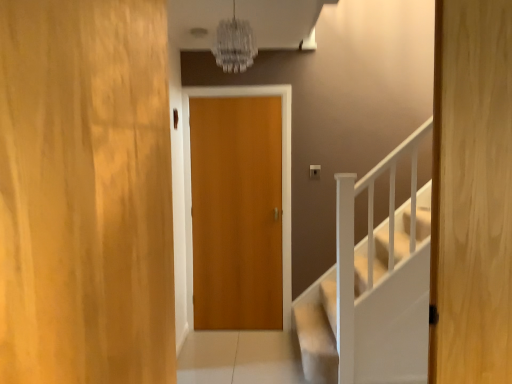
Question: Which direction should I rotate to look at wooden door at center, the second door in the front-to-back sequence?

Choices:
 (A) left
 (B) right

Answer: (B)

Question: Is wooden door at center, which is the first door in back-to-front order, to the right of wooden door at center, positioned as the 1th door in front-to-back order, from the viewer's perspective?

Choices:
 (A) no
 (B) yes

Answer: (B)

Question: From the image's perspective, would you say wooden door at center, the third door from the front, is shown under wooden door at center, positioned as the 1th door in front-to-back order?

Choices:
 (A) yes
 (B) no

Answer: (A)

Question: Is wooden door at center, the third door from the front, bigger than wooden door at center, which is the third door in right-to-left order?

Choices:
 (A) no
 (B) yes

Answer: (A)

Question: Is the depth of wooden door at center, which is the first door in back-to-front order, greater than that of wooden door at center, marked as the 3th door in a back-to-front arrangement?

Choices:
 (A) no
 (B) yes

Answer: (B)

Question: Is wooden door at center, the third door from the front, facing away from wooden door at center, marked as the 3th door in a back-to-front arrangement?

Choices:
 (A) yes
 (B) no

Answer: (B)

Question: Can you confirm if wooden door at center, the second door in the right-to-left sequence, is smaller than wooden door at center, which is the third door in right-to-left order?

Choices:
 (A) yes
 (B) no

Answer: (A)

Question: Would you consider wooden door at center, which is the 1th door from right to left, to be distant from wooden door at center, marked as the 2th door in a left-to-right arrangement?

Choices:
 (A) yes
 (B) no

Answer: (A)

Question: From the image's perspective, is wooden door at center, which is the 1th door from right to left, located beneath wooden door at center, marked as the 2th door in a left-to-right arrangement?

Choices:
 (A) no
 (B) yes

Answer: (A)

Question: Is wooden door at center, the second door in the front-to-back sequence, directly adjacent to wooden door at center, the second door in the right-to-left sequence?

Choices:
 (A) yes
 (B) no

Answer: (B)

Question: Is wooden door at center, which is the first door in back-to-front order, completely or partially inside wooden door at center, the second door in the front-to-back sequence?

Choices:
 (A) no
 (B) yes

Answer: (A)

Question: Considering the relative sizes of wooden door at center, which is the 1th door from right to left, and wooden door at center, the third door from the front, in the image provided, is wooden door at center, which is the 1th door from right to left, taller than wooden door at center, the third door from the front,?

Choices:
 (A) no
 (B) yes

Answer: (A)

Question: Can you confirm if wooden door at center, the 3th door in the left-to-right sequence, is bigger than wooden door at center, which is the first door in back-to-front order?

Choices:
 (A) yes
 (B) no

Answer: (B)

Question: Is the depth of wooden door at center, positioned as the 1th door in front-to-back order, less than that of wooden door at center, marked as the 2th door in a left-to-right arrangement?

Choices:
 (A) no
 (B) yes

Answer: (B)